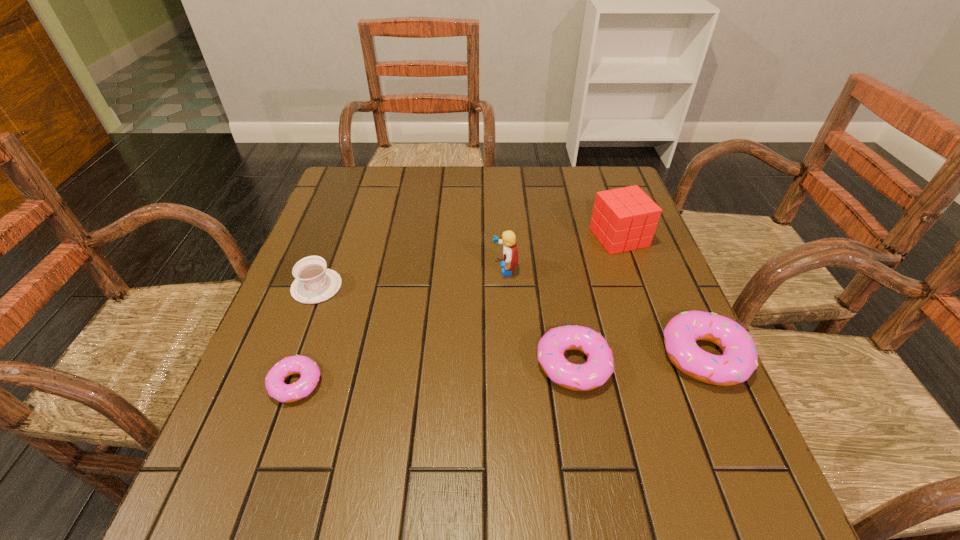
Find the location of a particular element. The height and width of the screenshot is (540, 960). cube positioned at the right edge is located at coordinates (623, 219).

This screenshot has height=540, width=960. Identify the location of object that is at the near left corner. (298, 364).

Image resolution: width=960 pixels, height=540 pixels. Find the location of `free space at the far edge of the desktop`. free space at the far edge of the desktop is located at coordinates (396, 192).

Where is `vacant point at the near edge`? vacant point at the near edge is located at coordinates (492, 409).

This screenshot has height=540, width=960. I want to click on vacant space at the left edge, so click(x=366, y=215).

This screenshot has height=540, width=960. I want to click on vacant space at the right edge of the desktop, so click(x=652, y=262).

The image size is (960, 540). In the image, there is a desktop. What are the coordinates of `vacant space at the far left corner` in the screenshot? It's located at (361, 195).

At what (x,y) coordinates should I click in order to perform the action: click on vacant area at the near left corner. Please return your answer as a coordinate pair (x, y). The height and width of the screenshot is (540, 960). Looking at the image, I should click on (308, 420).

Locate an element on the screen. Image resolution: width=960 pixels, height=540 pixels. free space at the far right corner is located at coordinates click(x=599, y=172).

At what (x,y) coordinates should I click in order to perform the action: click on free space at the near right corner of the desktop. Please return your answer as a coordinate pair (x, y). Looking at the image, I should click on pyautogui.click(x=651, y=447).